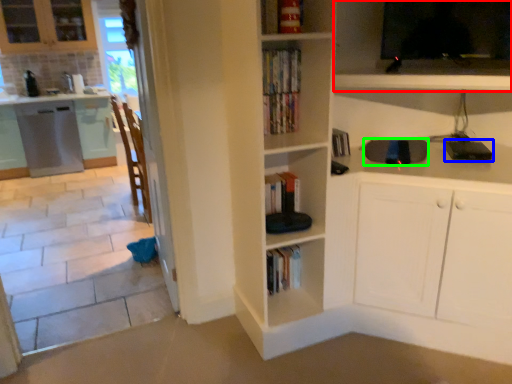
Question: Which object is positioned farthest from shelf (highlighted by a red box)? Select from appliance (highlighted by a blue box) and appliance (highlighted by a green box).

Choices:
 (A) appliance
 (B) appliance

Answer: (A)